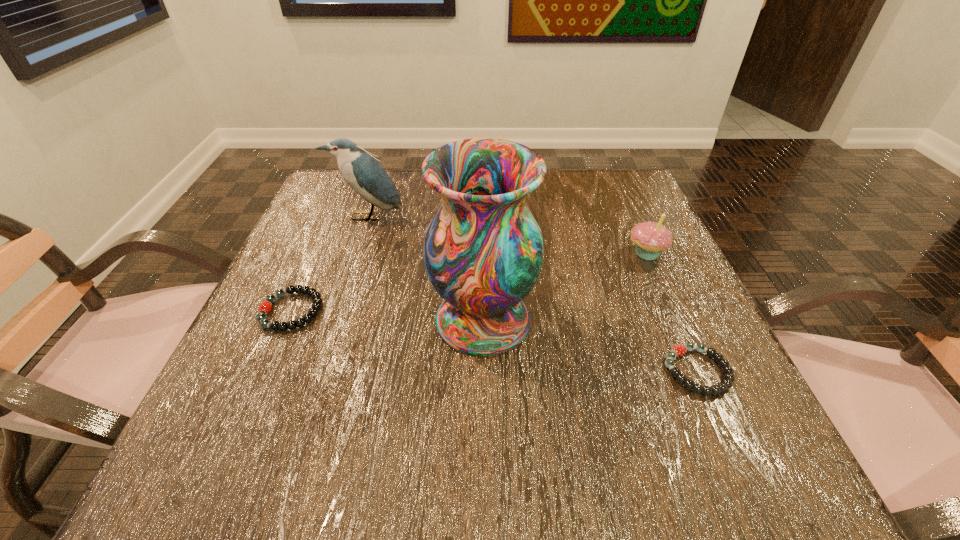
Where is `the third object from left to right`? This screenshot has height=540, width=960. the third object from left to right is located at coordinates tap(483, 251).

You are a GUI agent. You are given a task and a screenshot of the screen. Output one action in this format:
    pyautogui.click(x=<x>, y=<y>)
    Task: Click on the vase
    The width and height of the screenshot is (960, 540).
    Given the screenshot: What is the action you would take?
    pyautogui.click(x=483, y=251)

Find the location of a particular element. The height and width of the screenshot is (540, 960). the farthest object is located at coordinates (364, 174).

The height and width of the screenshot is (540, 960). What are the coordinates of `bird` in the screenshot? It's located at (364, 174).

Find the location of a particular element. cupcake is located at coordinates (650, 238).

Where is `the fourth nearest object`? Image resolution: width=960 pixels, height=540 pixels. the fourth nearest object is located at coordinates (650, 238).

At what (x,y) coordinates should I click in order to perform the action: click on the left bracelet. Please return your answer as a coordinate pair (x, y). This screenshot has width=960, height=540. Looking at the image, I should click on (265, 307).

Identify the location of the nearer bracelet. This screenshot has height=540, width=960. (678, 350).

Locate an element on the screen. vacant space located 0.380m on the back of the third object from left to right is located at coordinates (482, 183).

The width and height of the screenshot is (960, 540). Find the location of `vacant area located 0.280m at the tip of the farthest object's beak`. vacant area located 0.280m at the tip of the farthest object's beak is located at coordinates (334, 316).